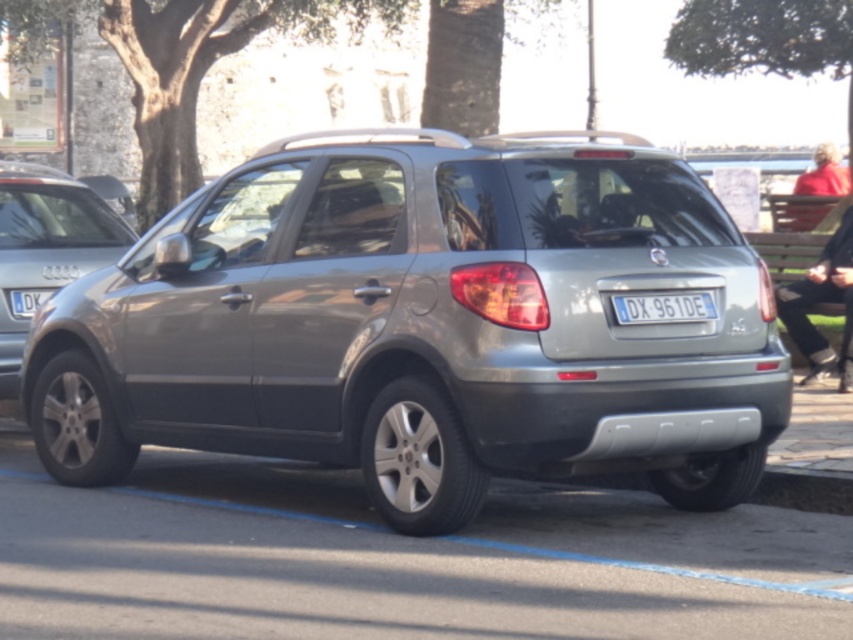
You are a photographer trying to capture both the satin silver suv at left and the red fabric jacket at upper right in a single frame. Given their sizes, which object should you focus on first to ensure both fit in the photo?

The satin silver suv at left is smaller than the red fabric jacket at upper right. To ensure both fit in the photo, focus on positioning the camera to accommodate the larger red fabric jacket at upper right first, then adjust to include the smaller satin silver suv at left.

You are a delivery person who needs to attach a large package to the roof of the silver SUV. The package is the size of the red sweater at right. Can you fit it on the roof rack if the maximum load capacity is based on the size of the blue metallic license plate at lower left?

The red sweater at right has a larger size compared to the blue metallic license plate at lower left. Since the package is the size of the red sweater at right, which is larger than the maximum load capacity based on the license plate size, it cannot be safely attached to the roof rack.

In the scene shown: You are a delivery person trying to load a package onto the roof rack of the silver SUV. The package is 1.2 meters wide. The red sweater at right and the blue metallic license plate at lower left are visible from your position. Based on their widths, can the package fit on the roof rack?

The red sweater at right might be wider than blue metallic license plate at lower left. Since the package is 1.2 meters wide, if the red sweater at right is indeed wider, it suggests the roof rack has sufficient width to accommodate the package. However, without exact measurements, there is uncertainty. Proceed with caution.